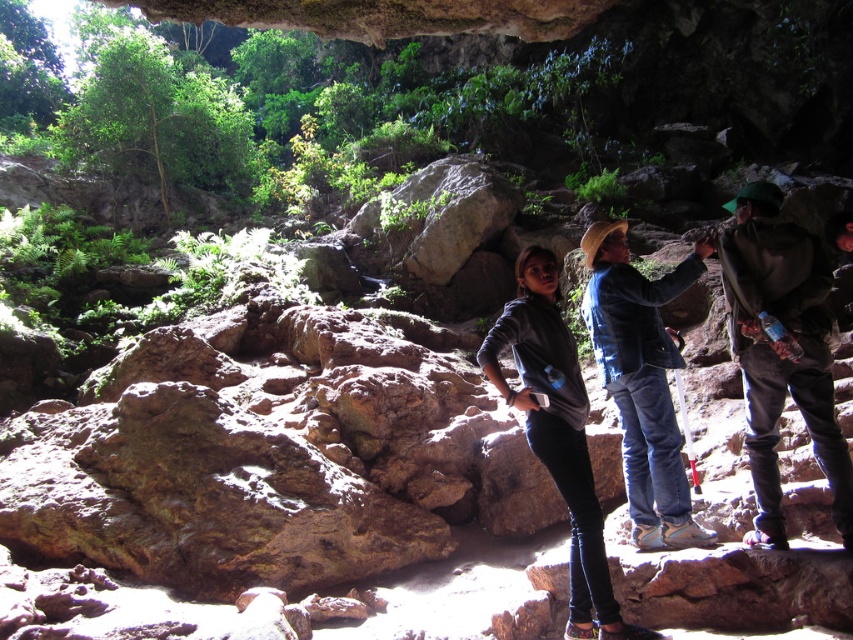
You are a hiker trying to locate your two jackets in the cave. You remember that the dark brown leather jacket at right is positioned to the right of the gray matte jacket at center. Which jacket is closer to the stream if the stream is located on the right side of the cave?

The dark brown leather jacket at right is to the right of the gray matte jacket at center, so the dark brown leather jacket at right is closer to the stream located on the right side of the cave.